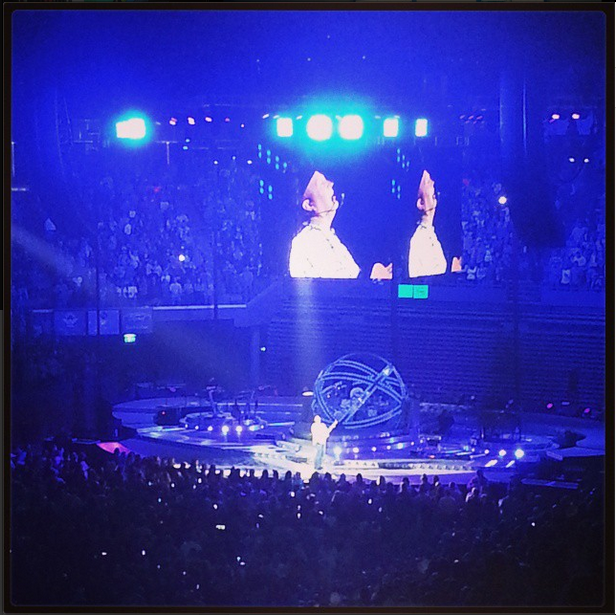
Identify the location of screen. The width and height of the screenshot is (616, 615). (322, 224).